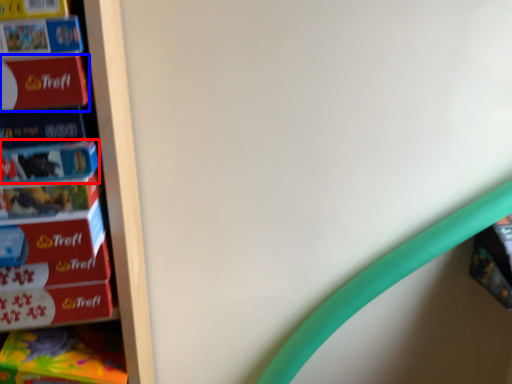
Question: Which object appears closest to the camera in this image, paperback book (highlighted by a red box) or paperback book (highlighted by a blue box)?

Choices:
 (A) paperback book
 (B) paperback book

Answer: (B)